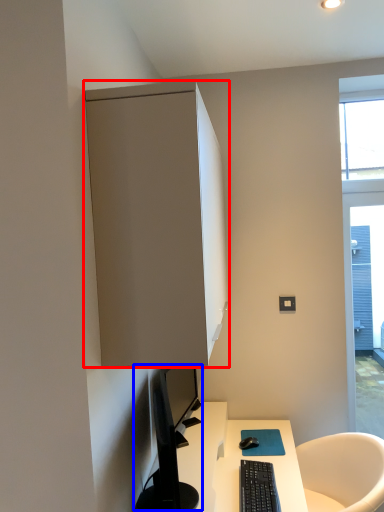
Question: Among these objects, which one is nearest to the camera, cabinetry (highlighted by a red box) or computer monitor (highlighted by a blue box)?

Choices:
 (A) cabinetry
 (B) computer monitor

Answer: (A)